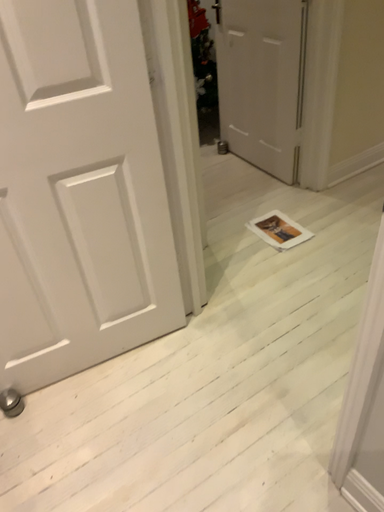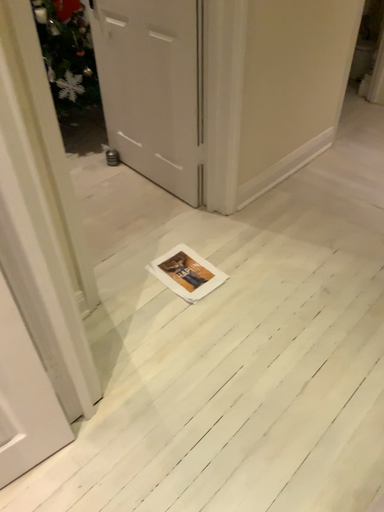
Question: Which way did the camera rotate in the video?

Choices:
 (A) rotated right
 (B) rotated left

Answer: (A)